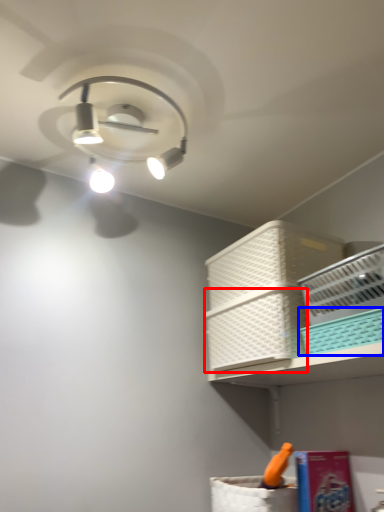
Question: Which object is closer to the camera taking this photo, basket (highlighted by a red box) or basket (highlighted by a blue box)?

Choices:
 (A) basket
 (B) basket

Answer: (B)